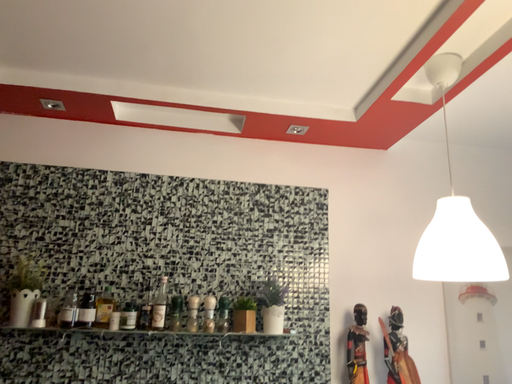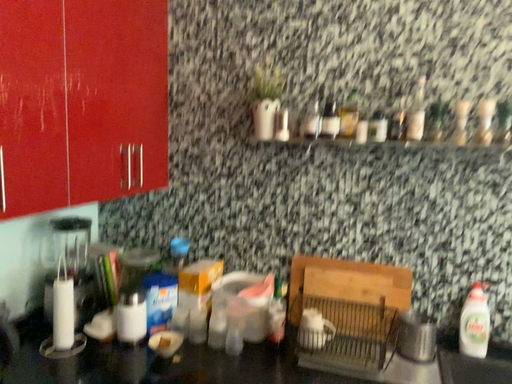
Question: Which way did the camera rotate in the video?

Choices:
 (A) rotated upward
 (B) rotated downward

Answer: (B)